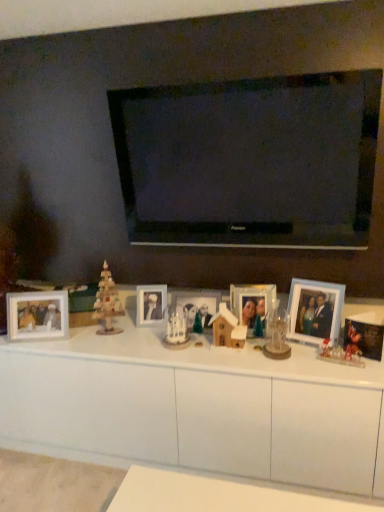
What do you see at coordinates (196, 306) in the screenshot? I see `matte silver photo frame at center, which ranks as the 3th picture frame in left-to-right order` at bounding box center [196, 306].

This screenshot has height=512, width=384. What do you see at coordinates (252, 303) in the screenshot?
I see `clear glass photo frame at center, positioned as the 4th picture frame in left-to-right order` at bounding box center [252, 303].

Identify the location of clear glass photo frame at center, positioned as the 4th picture frame in left-to-right order. This screenshot has height=512, width=384. (252, 303).

Where is `matte white photo frame at center, the 5th picture frame viewed from the right`? This screenshot has width=384, height=512. matte white photo frame at center, the 5th picture frame viewed from the right is located at coordinates (150, 304).

Locate an element on the screen. The height and width of the screenshot is (512, 384). metallic mickey mouse photo frame at right, the first picture frame viewed from the right is located at coordinates (363, 338).

In order to click on wooden house at center, the first toy in the left-to-right sequence in this screenshot , I will do `click(227, 329)`.

Find the location of `white glossy cabinet at center`. white glossy cabinet at center is located at coordinates (196, 408).

Which is behind, point (17, 309) or point (189, 296)?

The point (189, 296) is farther.

Looking at their sizes, would you say wooden photo frame at left, placed as the first picture frame when sorted from left to right, is wider or thinner than matte silver photo frame at center, acting as the fourth picture frame starting from the right?

Clearly, wooden photo frame at left, placed as the first picture frame when sorted from left to right, has more width compared to matte silver photo frame at center, acting as the fourth picture frame starting from the right.

Is wooden photo frame at left, marked as the sixth picture frame in a right-to-left arrangement, positioned beyond the bounds of matte silver photo frame at center, which ranks as the 3th picture frame in left-to-right order?

wooden photo frame at left, marked as the sixth picture frame in a right-to-left arrangement, lies outside matte silver photo frame at center, which ranks as the 3th picture frame in left-to-right order,'s area.

Which of these two, translucent plastic gingerbread house at lower right, the 2th toy from the left, or white glossy cabinet at center, stands shorter?

With less height is translucent plastic gingerbread house at lower right, the 2th toy from the left.

Does translucent plastic gingerbread house at lower right, the 2th toy positioned from the back, appear on the left side of white glossy cabinet at center?

Incorrect, translucent plastic gingerbread house at lower right, the 2th toy positioned from the back, is not on the left side of white glossy cabinet at center.

Who is bigger, translucent plastic gingerbread house at lower right, which appears as the first toy when viewed from the front, or white glossy cabinet at center?

With larger size is white glossy cabinet at center.

From a real-world perspective, which object stands above the other?

translucent plastic gingerbread house at lower right, which appears as the first toy when viewed from the front, from a real-world perspective.

Which of these two, metallic mickey mouse photo frame at right, the 6th picture frame when ordered from left to right, or white glossy cabinet at center, stands taller?

Standing taller between the two is white glossy cabinet at center.

Considering the relative positions of metallic mickey mouse photo frame at right, the 6th picture frame when ordered from left to right, and white glossy cabinet at center in the image provided, is metallic mickey mouse photo frame at right, the 6th picture frame when ordered from left to right, to the left of white glossy cabinet at center from the viewer's perspective?

Incorrect, metallic mickey mouse photo frame at right, the 6th picture frame when ordered from left to right, is not on the left side of white glossy cabinet at center.

Which is closer, (381, 351) or (32, 394)?

Positioned in front is point (381, 351).

Considering the positions of objects metallic mickey mouse photo frame at right, the 6th picture frame when ordered from left to right, and white glossy cabinet at center in the image provided, who is in front, metallic mickey mouse photo frame at right, the 6th picture frame when ordered from left to right, or white glossy cabinet at center?

white glossy cabinet at center is more forward.

From a real-world perspective, is wooden christmas tree at left physically above metallic mickey mouse photo frame at right, the first picture frame viewed from the right?

Correct, in the physical world, wooden christmas tree at left is higher than metallic mickey mouse photo frame at right, the first picture frame viewed from the right.

Is metallic mickey mouse photo frame at right, the 6th picture frame when ordered from left to right, at the back of wooden christmas tree at left?

No, wooden christmas tree at left is not facing away from metallic mickey mouse photo frame at right, the 6th picture frame when ordered from left to right.

Which of these two, wooden christmas tree at left or metallic mickey mouse photo frame at right, the first picture frame viewed from the right, stands taller?

wooden christmas tree at left.

Between wooden christmas tree at left and wooden house at center, positioned as the 1th toy in back-to-front order, which one has larger size?

wooden christmas tree at left is bigger.

Does wooden christmas tree at left have a lesser height compared to wooden house at center, positioned as the 1th toy in back-to-front order?

No, wooden christmas tree at left is not shorter than wooden house at center, positioned as the 1th toy in back-to-front order.

Is wooden christmas tree at left further to the viewer compared to wooden house at center, positioned as the 1th toy in back-to-front order?

Yes, it is behind wooden house at center, positioned as the 1th toy in back-to-front order.

Identify the location of the 1st toy below when counting from the wooden christmas tree at left (from the image's perspective). (227, 329).

Is matte silver photo frame at center, acting as the fourth picture frame starting from the right, behind translucent plastic gingerbread house at lower right, which appears as the first toy when viewed from the front?

Yes, the depth of matte silver photo frame at center, acting as the fourth picture frame starting from the right, is greater than that of translucent plastic gingerbread house at lower right, which appears as the first toy when viewed from the front.

Is matte silver photo frame at center, which ranks as the 3th picture frame in left-to-right order, smaller than translucent plastic gingerbread house at lower right, the 2th toy from the left?

No, matte silver photo frame at center, which ranks as the 3th picture frame in left-to-right order, is not smaller than translucent plastic gingerbread house at lower right, the 2th toy from the left.

Can you confirm if matte silver photo frame at center, acting as the fourth picture frame starting from the right, is positioned to the right of translucent plastic gingerbread house at lower right, which appears as the first toy when viewed from the front?

Incorrect, matte silver photo frame at center, acting as the fourth picture frame starting from the right, is not on the right side of translucent plastic gingerbread house at lower right, which appears as the first toy when viewed from the front.

Between white glossy cabinet at center and matte silver photo frame at center, which ranks as the 3th picture frame in left-to-right order, which one appears on the right side from the viewer's perspective?

From the viewer's perspective, matte silver photo frame at center, which ranks as the 3th picture frame in left-to-right order, appears more on the right side.

Image resolution: width=384 pixels, height=512 pixels. Identify the location of the 3rd picture frame directly above the white glossy cabinet at center (from a real-world perspective). (196, 306).

Considering the relative sizes of white glossy cabinet at center and matte silver photo frame at center, acting as the fourth picture frame starting from the right, in the image provided, is white glossy cabinet at center taller than matte silver photo frame at center, acting as the fourth picture frame starting from the right,?

Yes.

From a real-world perspective, is white glossy cabinet at center physically below matte silver photo frame at center, acting as the fourth picture frame starting from the right?

Yes, from a real-world perspective, white glossy cabinet at center is under matte silver photo frame at center, acting as the fourth picture frame starting from the right.

You are a GUI agent. You are given a task and a screenshot of the screen. Output one action in this format:
    pyautogui.click(x=<x>, y=<y>)
    Task: Click on the 2nd picture frame counting from the right side of the wooden photo frame at left, placed as the first picture frame when sorted from left to right
    
    Given the screenshot: What is the action you would take?
    pyautogui.click(x=196, y=306)

Where is `table in front of the translucent plastic gingerbread house at lower right, which appears as the first toy when viewed from the front`? The height and width of the screenshot is (512, 384). table in front of the translucent plastic gingerbread house at lower right, which appears as the first toy when viewed from the front is located at coordinates (196, 408).

Based on their spatial positions, is wooden christmas tree at left or translucent plastic gingerbread house at lower right, the 2th toy from the left, further from wooden house at center, placed as the 2th toy when sorted from right to left?

The object further to wooden house at center, placed as the 2th toy when sorted from right to left, is wooden christmas tree at left.

Which object lies further to the anchor point translucent plastic gingerbread house at lower right, which appears as the first toy when viewed from the front, white glossy cabinet at center or wooden christmas tree at left?

Among the two, wooden christmas tree at left is located further to translucent plastic gingerbread house at lower right, which appears as the first toy when viewed from the front.

Based on their spatial positions, is matte silver photo frame at center, which ranks as the 3th picture frame in left-to-right order, or wooden house at center, positioned as the 1th toy in back-to-front order, closer to light blue plastic picture frame at right, which appears as the 2th picture frame when viewed from the right?

wooden house at center, positioned as the 1th toy in back-to-front order, is closer to light blue plastic picture frame at right, which appears as the 2th picture frame when viewed from the right.

Which object lies further to the anchor point matte silver photo frame at center, which ranks as the 3th picture frame in left-to-right order, wooden photo frame at left, marked as the sixth picture frame in a right-to-left arrangement, or translucent plastic gingerbread house at lower right, the 2th toy positioned from the back?

wooden photo frame at left, marked as the sixth picture frame in a right-to-left arrangement, is positioned further to the anchor matte silver photo frame at center, which ranks as the 3th picture frame in left-to-right order.

From the image, which object appears to be nearer to wooden christmas tree at left, translucent plastic gingerbread house at lower right, which appears as the first toy when viewed from the front, or clear glass photo frame at center, positioned as the 4th picture frame in left-to-right order?

Among the two, clear glass photo frame at center, positioned as the 4th picture frame in left-to-right order, is located nearer to wooden christmas tree at left.

When comparing their distances from metallic mickey mouse photo frame at right, the 6th picture frame when ordered from left to right, does wooden photo frame at left, marked as the sixth picture frame in a right-to-left arrangement, or white glossy cabinet at center seem further?

wooden photo frame at left, marked as the sixth picture frame in a right-to-left arrangement, is further to metallic mickey mouse photo frame at right, the 6th picture frame when ordered from left to right.

From the image, which object appears to be nearer to white glossy cabinet at center, light blue plastic picture frame at right, which appears as the 2th picture frame when viewed from the right, or metallic mickey mouse photo frame at right, the 6th picture frame when ordered from left to right?

Among the two, light blue plastic picture frame at right, which appears as the 2th picture frame when viewed from the right, is located nearer to white glossy cabinet at center.

From the image, which object appears to be nearer to wooden photo frame at left, marked as the sixth picture frame in a right-to-left arrangement, white glossy cabinet at center or wooden house at center, placed as the 2th toy when sorted from right to left?

white glossy cabinet at center.

The image size is (384, 512). Find the location of `picture frame situated between wooden house at center, positioned as the 1th toy in back-to-front order, and light blue plastic picture frame at right, marked as the 5th picture frame in a left-to-right arrangement, from left to right`. picture frame situated between wooden house at center, positioned as the 1th toy in back-to-front order, and light blue plastic picture frame at right, marked as the 5th picture frame in a left-to-right arrangement, from left to right is located at coordinates (252, 303).

The width and height of the screenshot is (384, 512). Find the location of `picture frame located between clear glass photo frame at center, positioned as the 4th picture frame in left-to-right order, and translucent plastic gingerbread house at lower right, acting as the 1th toy starting from the right, in the left-right direction`. picture frame located between clear glass photo frame at center, positioned as the 4th picture frame in left-to-right order, and translucent plastic gingerbread house at lower right, acting as the 1th toy starting from the right, in the left-right direction is located at coordinates (315, 311).

Find the location of a particular element. The height and width of the screenshot is (512, 384). christmas decoration positioned between white glossy cabinet at center and matte silver photo frame at center, which ranks as the 3th picture frame in left-to-right order, from near to far is located at coordinates (107, 303).

Locate an element on the screen. The image size is (384, 512). table situated between wooden christmas tree at left and wooden house at center, acting as the second toy starting from the front, from left to right is located at coordinates (196, 408).